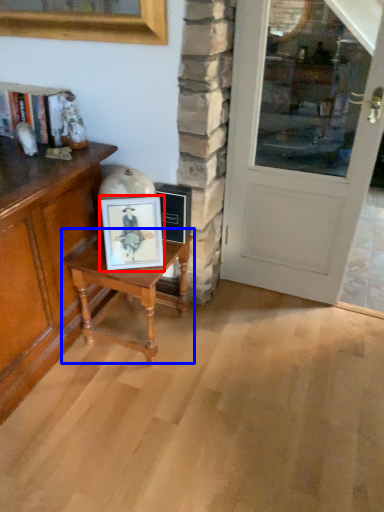
Question: Which of the following is the farthest to the observer, picture frame (highlighted by a red box) or table (highlighted by a blue box)?

Choices:
 (A) picture frame
 (B) table

Answer: (B)